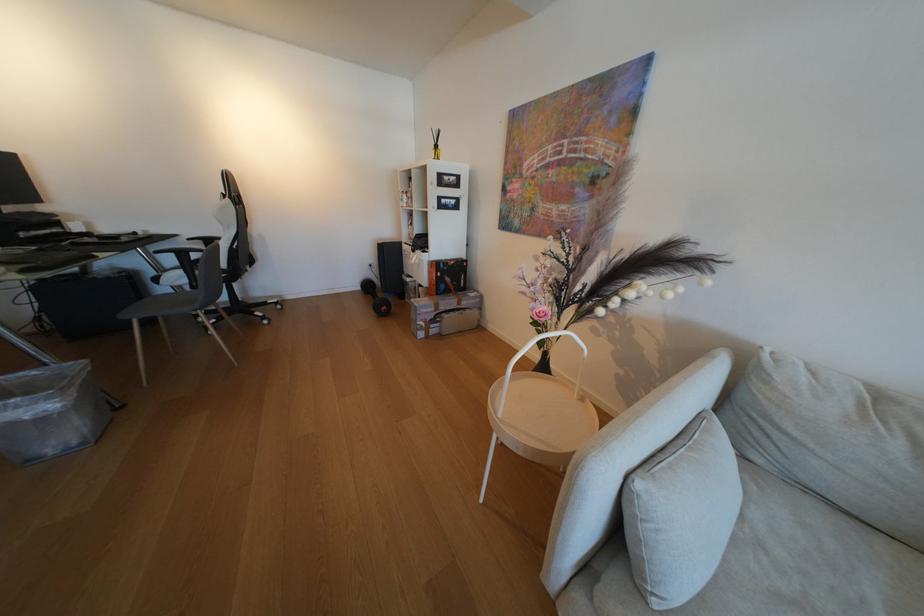
Describe the element at coordinates (675, 538) in the screenshot. I see `the grey sofa armrest` at that location.